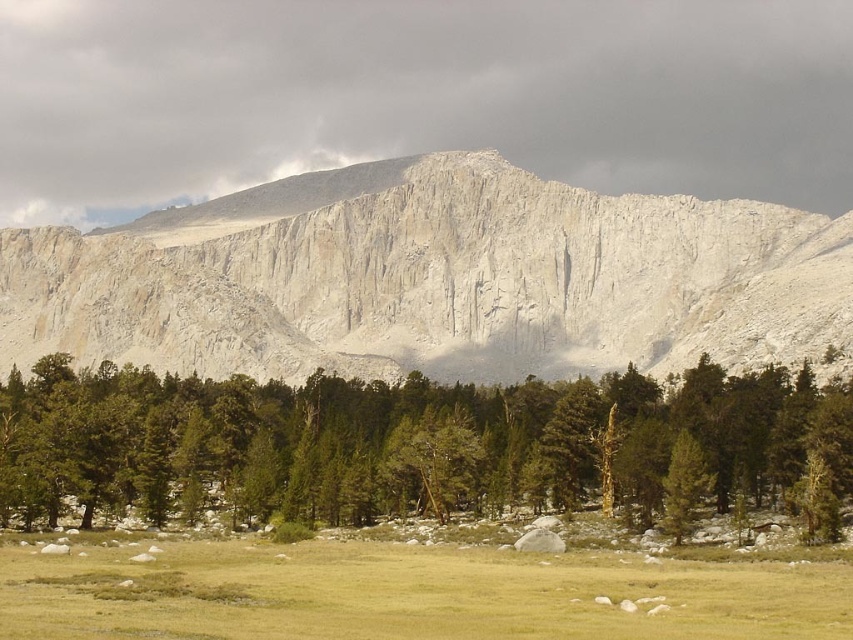
Question: Observing the image, what is the correct spatial positioning of white rock mountain at center in reference to green textured pine trees at lower center?

Choices:
 (A) below
 (B) above

Answer: (B)

Question: Among these objects, which one is farthest from the camera?

Choices:
 (A) white rock mountain at center
 (B) green textured pine trees at lower center

Answer: (A)

Question: Which of the following is the farthest from the observer?

Choices:
 (A) (699, 396)
 (B) (82, 307)

Answer: (B)

Question: Can you confirm if white rock mountain at center is positioned below green textured pine trees at lower center?

Choices:
 (A) yes
 (B) no

Answer: (B)

Question: Which object appears closest to the camera in this image?

Choices:
 (A) white rock mountain at center
 (B) green textured pine trees at lower center

Answer: (B)

Question: Does white rock mountain at center appear on the right side of green textured pine trees at lower center?

Choices:
 (A) yes
 (B) no

Answer: (A)